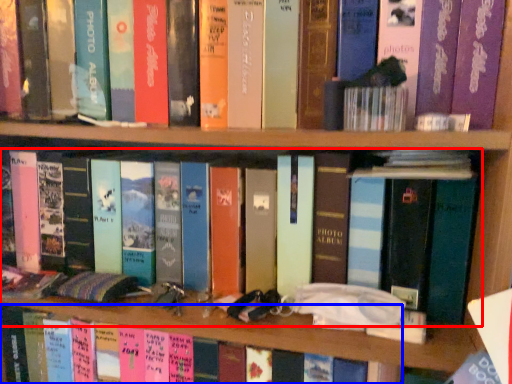
Question: Which object is closer to the camera taking this photo, book (highlighted by a red box) or book (highlighted by a blue box)?

Choices:
 (A) book
 (B) book

Answer: (A)